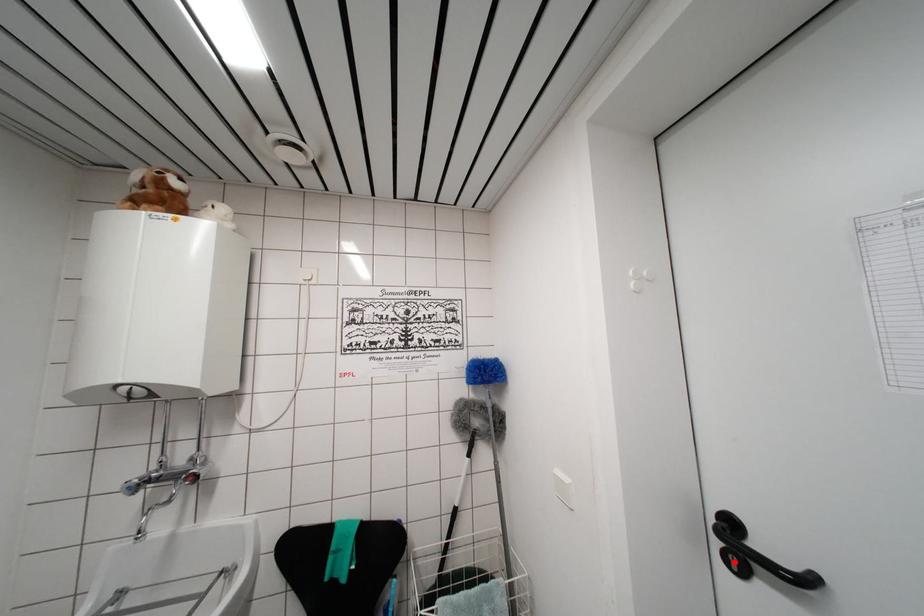
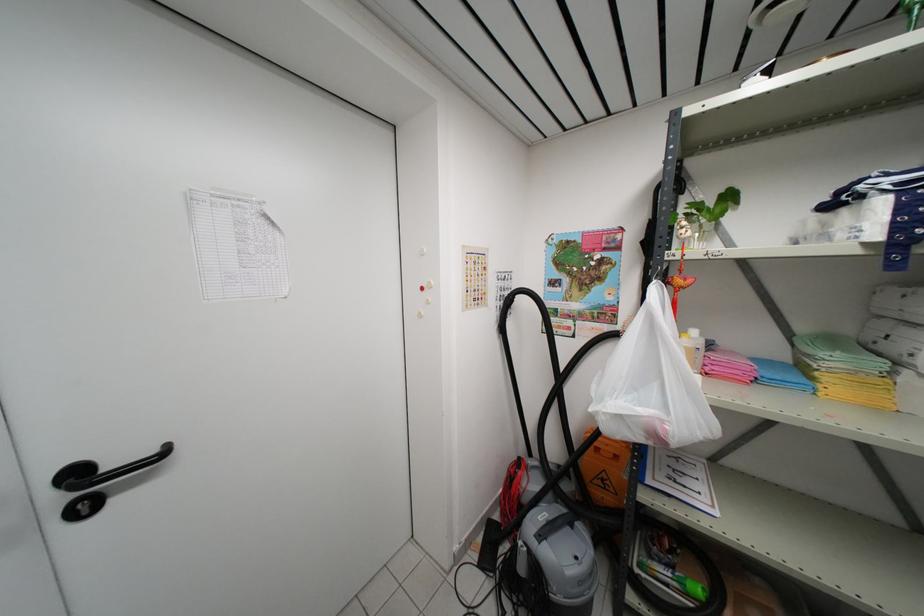
Where in the second image is the point corresponding to the highlighted location from the first image?

(83, 512)